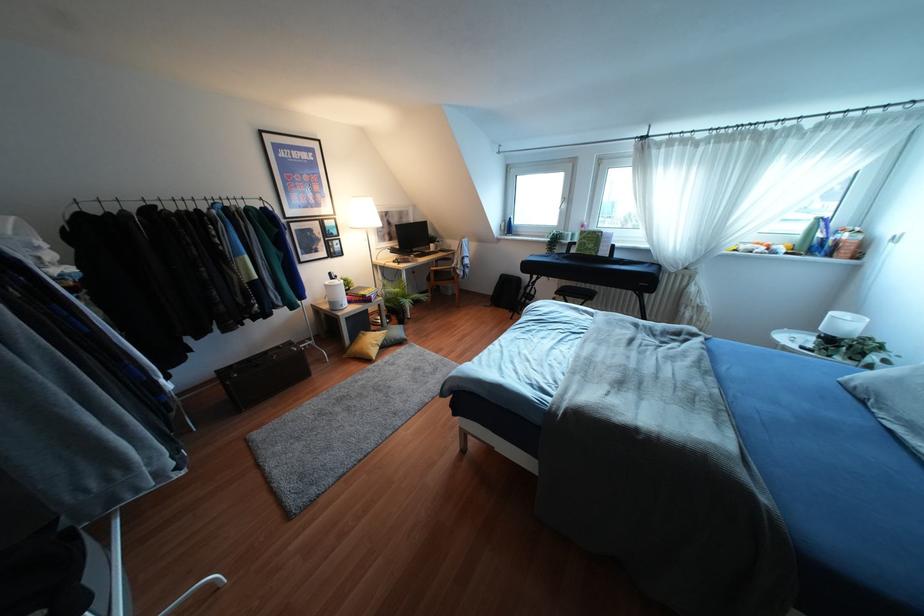
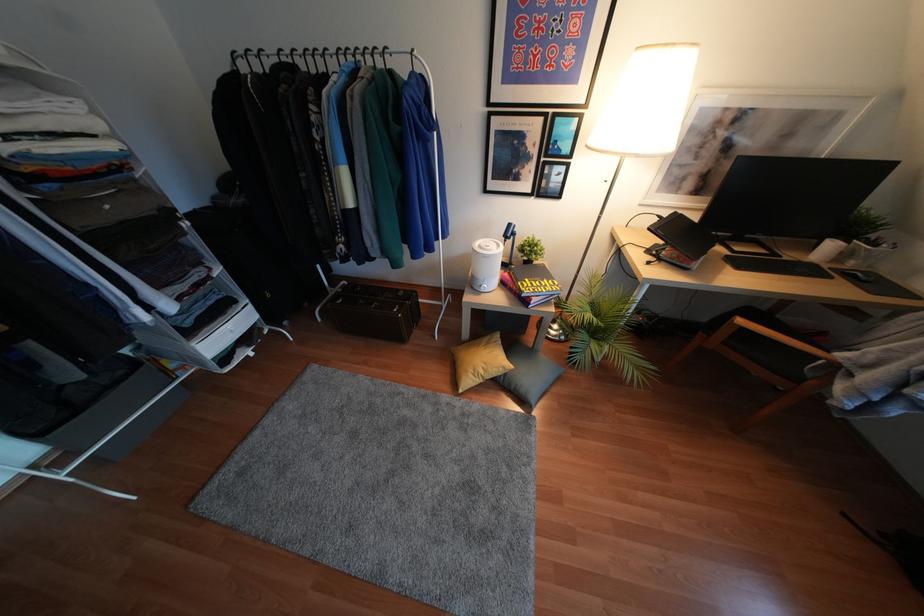
Find the pixel in the second image that matches (x=344, y=276) in the first image.

(536, 237)